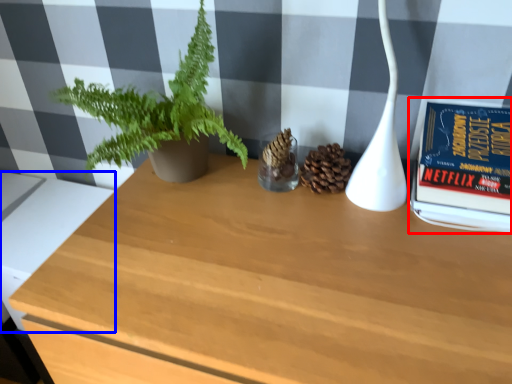
Question: Which object appears closest to the camera in this image, paperback book (highlighted by a red box) or table (highlighted by a blue box)?

Choices:
 (A) paperback book
 (B) table

Answer: (A)